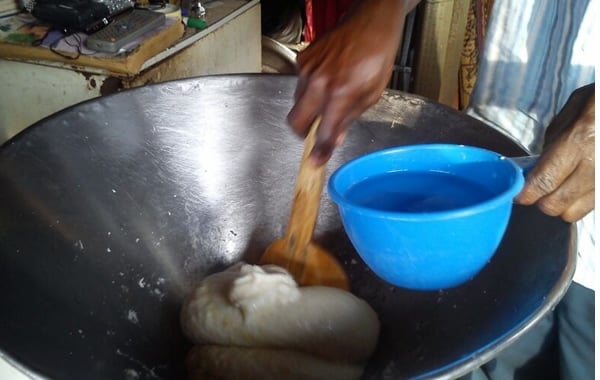
You are a GUI agent. You are given a task and a screenshot of the screen. Output one action in this format:
    pyautogui.click(x=<x>, y=<y>)
    Task: Click on the blue bowl
    This screenshot has height=380, width=600.
    Given the screenshot: What is the action you would take?
    pyautogui.click(x=431, y=268)